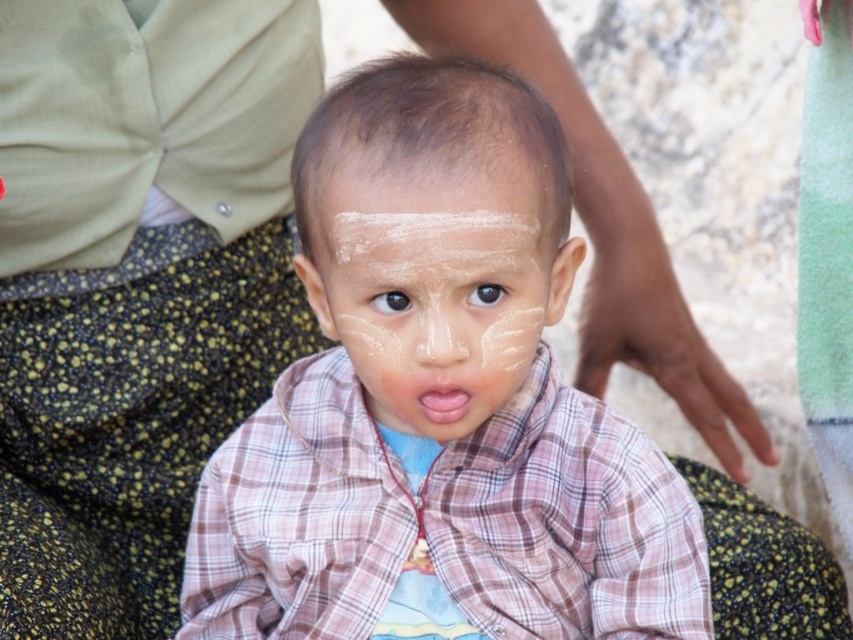
Question: Based on their relative distances, which object is nearer to the white matte paint at center?

Choices:
 (A) brown matte eye at center
 (B) black matte eye at center
 (C) white matte face at center

Answer: (C)

Question: Which of these objects is positioned farthest from the smooth plaid shirt at center?

Choices:
 (A) black matte eye at center
 (B) brown matte eye at center
 (C) white matte paint at center
 (D) white matte face at center

Answer: (B)

Question: Which point is closer to the camera?

Choices:
 (A) (x=502, y=236)
 (B) (x=491, y=296)

Answer: (A)

Question: Does smooth plaid shirt at center appear on the right side of brown matte eye at center?

Choices:
 (A) yes
 (B) no

Answer: (B)

Question: Is smooth plaid shirt at center to the left of white matte paint at center from the viewer's perspective?

Choices:
 (A) no
 (B) yes

Answer: (A)

Question: Where is white matte face at center located in relation to white matte paint at center in the image?

Choices:
 (A) right
 (B) left

Answer: (A)